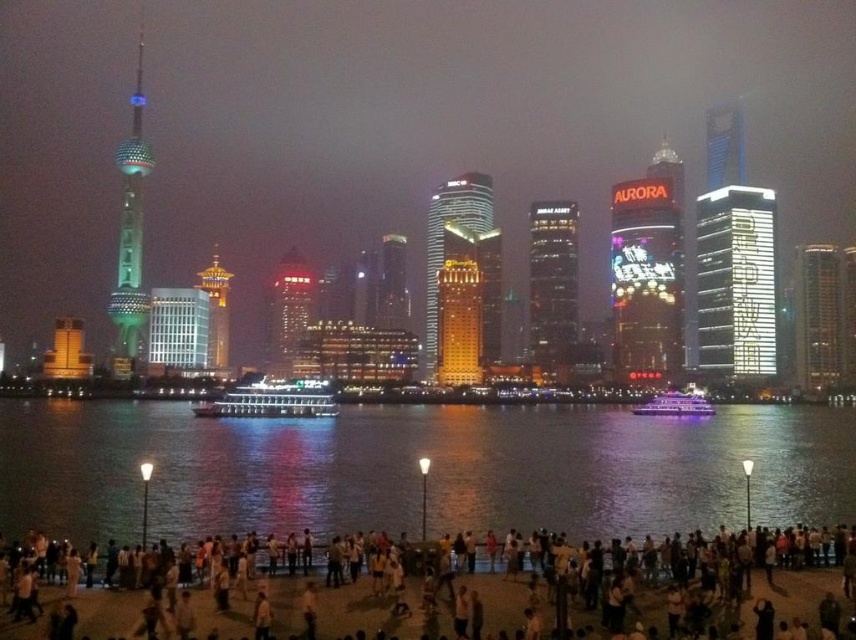
You are a drone operator trying to navigate between two points in the image. The first point is at coordinate point (658,365) and the second point is at coordinate point (449,353). Which point is closer to your current position if you are positioned at the same level as the points?

Point (449,353) is closer to your current position because it is nearer to the viewer compared to point (658,365), which is further away.

You are a photographer planning to capture the waterfront scene. You want to ensure that both the clear water at lower center and the matte glass skyscraper at center are visible in your shot. Based on their sizes, which object should you prioritize framing closer to the edge of the photo to avoid overcrowding?

The clear water at lower center is larger in size than the matte glass skyscraper at center, so you should prioritize framing the larger clear water at lower center closer to the edge of the photo to avoid overcrowding.